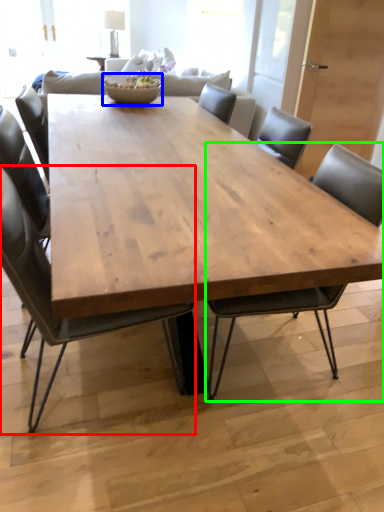
Question: Which object is the farthest from chair (highlighted by a red box)? Choose among these: bowl (highlighted by a blue box) or chair (highlighted by a green box).

Choices:
 (A) bowl
 (B) chair

Answer: (A)